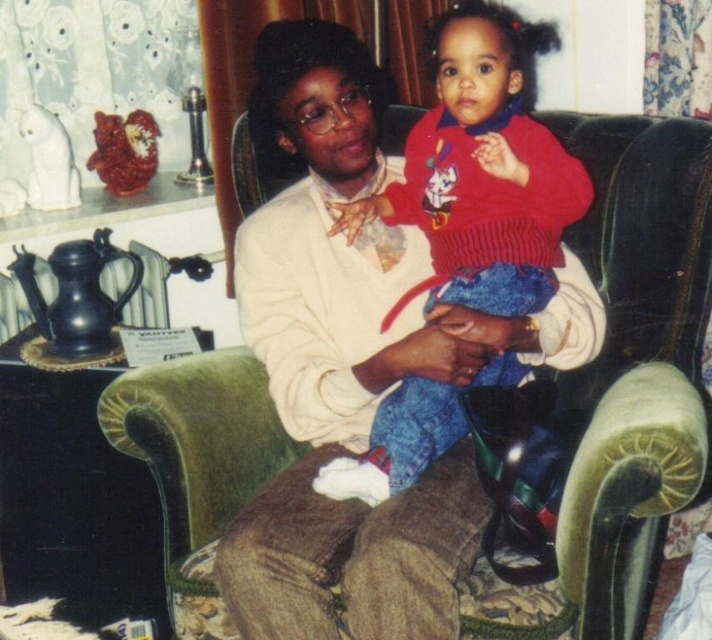
Is point (592, 490) positioned after point (459, 276)?

No.

Can you confirm if velvet green couch at center is taller than red knit sweater at center?

Yes.

Is point (172, 621) positioned after point (481, 307)?

No, (172, 621) is in front of (481, 307).

Find the location of `velvet green couch at center`. velvet green couch at center is located at coordinates (642, 250).